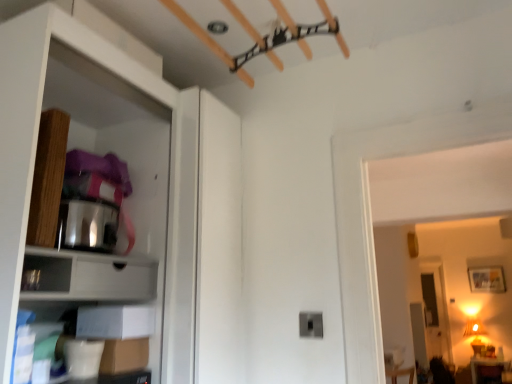
In the scene shown: What is the approximate height of white matte cabinet at lower left?

The height of white matte cabinet at lower left is 4.16 inches.

Measure the distance between matte white cabinet at left and camera.

A distance of 95.44 centimeters exists between matte white cabinet at left and camera.

This screenshot has height=384, width=512. I want to click on matte black drawer at lower left, so click(x=46, y=274).

Locate an element on the screen. The height and width of the screenshot is (384, 512). white matte cabinet at lower left is located at coordinates (89, 276).

Is white matte cabinet at lower left not inside matte brown cushion at lower right?

That's correct, white matte cabinet at lower left is outside of matte brown cushion at lower right.

Is point (140, 280) closer or farther from the camera than point (490, 369)?

Point (140, 280) is positioned closer to the camera compared to point (490, 369).

Looking at this image, can you confirm if white matte cabinet at lower left is taller than matte brown cushion at lower right?

No, white matte cabinet at lower left is not taller than matte brown cushion at lower right.

From the image's perspective, is white matte cabinet at lower left below matte brown cushion at lower right?

Actually, white matte cabinet at lower left appears above matte brown cushion at lower right in the image.

From the image's perspective, is matte brown cushion at lower right located beneath white matte cabinet at lower left?

Correct, matte brown cushion at lower right appears lower than white matte cabinet at lower left in the image.

Which of these two, matte brown cushion at lower right or white matte cabinet at lower left, stands taller?

matte brown cushion at lower right.

Considering the sizes of objects matte brown cushion at lower right and white matte cabinet at lower left in the image provided, who is wider, matte brown cushion at lower right or white matte cabinet at lower left?

Wider between the two is matte brown cushion at lower right.

Which is more to the left, matte white cabinet at left or matte brown cushion at lower right?

matte white cabinet at left.

From the image's perspective, which is below, matte white cabinet at left or matte brown cushion at lower right?

matte brown cushion at lower right.

From their relative heights in the image, would you say matte white cabinet at left is taller or shorter than matte brown cushion at lower right?

Considering their sizes, matte white cabinet at left has more height than matte brown cushion at lower right.

From a real-world perspective, between matte white cabinet at left and matte brown cushion at lower right, who is vertically lower?

From a 3D spatial view, matte brown cushion at lower right is below.

Identify the location of drawer that is on the left side of matte white cabinet at left. This screenshot has width=512, height=384. (46, 274).

Between matte black drawer at lower left and matte white cabinet at left, which one has larger size?

Bigger between the two is matte white cabinet at left.

Does point (67, 266) lie in front of point (148, 161)?

Yes.

Is matte black drawer at lower left positioned far away from matte brown cushion at lower right?

matte black drawer at lower left is positioned a significant distance from matte brown cushion at lower right.

Is matte brown cushion at lower right inside matte black drawer at lower left?

That's incorrect, matte brown cushion at lower right is not inside matte black drawer at lower left.

From a real-world perspective, between matte black drawer at lower left and matte brown cushion at lower right, who is vertically lower?

From a 3D spatial view, matte brown cushion at lower right is below.

Is matte white cabinet at left not near white matte cabinet at lower left?

No, matte white cabinet at left is not far away from white matte cabinet at lower left.

Which is correct: matte white cabinet at left is inside white matte cabinet at lower left, or outside of it?

matte white cabinet at left cannot be found inside white matte cabinet at lower left.

From a real-world perspective, is matte white cabinet at left positioned above or below white matte cabinet at lower left?

matte white cabinet at left is situated higher than white matte cabinet at lower left in the real world.

Is matte brown cushion at lower right bigger or smaller than matte black drawer at lower left?

Considering their sizes, matte brown cushion at lower right takes up more space than matte black drawer at lower left.

Considering the points (497, 372) and (28, 267), which point is in front, point (497, 372) or point (28, 267)?

The point (28, 267) is closer.

What's the angular difference between matte brown cushion at lower right and matte black drawer at lower left's facing directions?

The facing directions of matte brown cushion at lower right and matte black drawer at lower left are 91.1 degrees apart.

Is matte brown cushion at lower right in front of or behind matte black drawer at lower left in the image?

In the image, matte brown cushion at lower right appears behind matte black drawer at lower left.

This screenshot has height=384, width=512. In order to click on cabinet on the left of matte brown cushion at lower right in this screenshot , I will do `click(89, 276)`.

The image size is (512, 384). I want to click on cabinet that appears above the matte brown cushion at lower right (from a real-world perspective), so click(x=89, y=276).

From the image, which object appears to be farther from matte brown cushion at lower right, matte black drawer at lower left or white matte cabinet at lower left?

Based on the image, matte black drawer at lower left appears to be further to matte brown cushion at lower right.

Looking at the image, which one is located closer to matte white cabinet at left, white matte cabinet at lower left or matte black drawer at lower left?

Based on the image, white matte cabinet at lower left appears to be nearer to matte white cabinet at left.

Which object lies further to the anchor point white matte cabinet at lower left, matte white cabinet at left or matte black drawer at lower left?

matte white cabinet at left is further to white matte cabinet at lower left.

Looking at the image, which one is located further to matte white cabinet at left, matte black drawer at lower left or matte brown cushion at lower right?

Based on the image, matte brown cushion at lower right appears to be further to matte white cabinet at left.

Based on the photo, estimate the real-world distances between objects in this image. Which object is further from white matte cabinet at lower left, matte brown cushion at lower right or matte black drawer at lower left?

matte brown cushion at lower right is positioned further to the anchor white matte cabinet at lower left.

From the image, which object appears to be nearer to matte black drawer at lower left, white matte cabinet at lower left or matte white cabinet at left?

white matte cabinet at lower left is positioned closer to the anchor matte black drawer at lower left.

When comparing their distances from matte white cabinet at left, does matte black drawer at lower left or white matte cabinet at lower left seem further?

matte black drawer at lower left.

From the image, which object appears to be farther from matte brown cushion at lower right, white matte cabinet at lower left or matte white cabinet at left?

matte white cabinet at left is positioned further to the anchor matte brown cushion at lower right.

Locate an element on the screen. drawer between matte white cabinet at left and white matte cabinet at lower left from front to back is located at coordinates (46, 274).

Where is `drawer between matte white cabinet at left and matte brown cushion at lower right in the front-back direction`? Image resolution: width=512 pixels, height=384 pixels. drawer between matte white cabinet at left and matte brown cushion at lower right in the front-back direction is located at coordinates pyautogui.click(x=46, y=274).

Locate an element on the screen. The image size is (512, 384). cabinet between matte white cabinet at left and matte brown cushion at lower right from front to back is located at coordinates (89, 276).

Locate an element on the screen. The height and width of the screenshot is (384, 512). cabinet between matte black drawer at lower left and matte brown cushion at lower right along the z-axis is located at coordinates (89, 276).